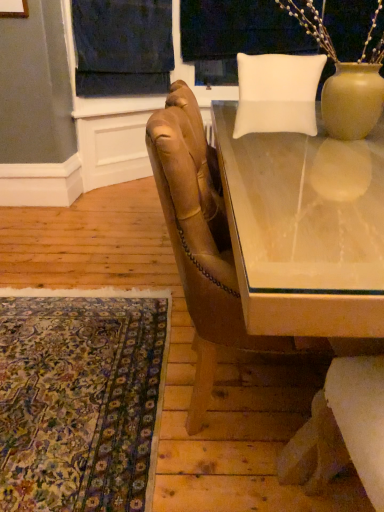
Question: Is dark blue fabric at upper center a part of clear glass table at center?

Choices:
 (A) yes
 (B) no

Answer: (B)

Question: Would you consider clear glass table at center to be distant from dark blue fabric at upper center?

Choices:
 (A) no
 (B) yes

Answer: (B)

Question: From the image's perspective, would you say clear glass table at center is shown under dark blue fabric at upper center?

Choices:
 (A) yes
 (B) no

Answer: (A)

Question: Does clear glass table at center have a greater width compared to dark blue fabric at upper center?

Choices:
 (A) yes
 (B) no

Answer: (A)

Question: Considering the relative positions of clear glass table at center and dark blue fabric at upper center in the image provided, is clear glass table at center in front of dark blue fabric at upper center?

Choices:
 (A) no
 (B) yes

Answer: (B)

Question: Is clear glass table at center oriented towards dark blue fabric at upper center?

Choices:
 (A) yes
 (B) no

Answer: (B)

Question: Are leather armchair at center and dark blue fabric at upper center far apart?

Choices:
 (A) no
 (B) yes

Answer: (B)

Question: Is the depth of leather armchair at center greater than that of dark blue fabric at upper center?

Choices:
 (A) no
 (B) yes

Answer: (A)

Question: Can dark blue fabric at upper center be found inside leather armchair at center?

Choices:
 (A) no
 (B) yes

Answer: (A)

Question: Could you tell me if leather armchair at center is turned towards dark blue fabric at upper center?

Choices:
 (A) no
 (B) yes

Answer: (A)

Question: From the image's perspective, would you say leather armchair at center is positioned over dark blue fabric at upper center?

Choices:
 (A) yes
 (B) no

Answer: (B)

Question: From the image's perspective, is leather armchair at center located beneath dark blue fabric at upper center?

Choices:
 (A) yes
 (B) no

Answer: (A)

Question: Is carpet with intricate patterns at lower left facing towards white fabric at upper center?

Choices:
 (A) no
 (B) yes

Answer: (A)